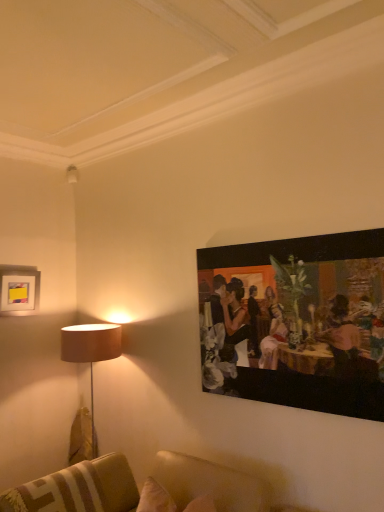
Question: Is the depth of leather couch at lower center less than that of matte white picture frame at upper left, which is the first picture frame in left-to-right order?

Choices:
 (A) yes
 (B) no

Answer: (A)

Question: Does leather couch at lower center lie behind matte white picture frame at upper left, marked as the 1th picture frame in a back-to-front arrangement?

Choices:
 (A) no
 (B) yes

Answer: (A)

Question: Is leather couch at lower center facing away from matte white picture frame at upper left, the 2th picture frame in the right-to-left sequence?

Choices:
 (A) no
 (B) yes

Answer: (A)

Question: Can you confirm if leather couch at lower center is smaller than matte white picture frame at upper left, the 2th picture frame in the right-to-left sequence?

Choices:
 (A) yes
 (B) no

Answer: (B)

Question: Is leather couch at lower center not within matte white picture frame at upper left, which is the first picture frame in left-to-right order?

Choices:
 (A) yes
 (B) no

Answer: (A)

Question: From the image's perspective, is leather couch at lower center located above matte white picture frame at upper left, the 2th picture frame in the right-to-left sequence?

Choices:
 (A) no
 (B) yes

Answer: (A)

Question: Does oil painting at upper right, the first picture frame when ordered from front to back, have a greater height compared to matte white picture frame at upper left, which is the first picture frame in left-to-right order?

Choices:
 (A) no
 (B) yes

Answer: (B)

Question: Is oil painting at upper right, which is the 2th picture frame in back-to-front order, further to camera compared to matte white picture frame at upper left, which is the first picture frame in left-to-right order?

Choices:
 (A) no
 (B) yes

Answer: (A)

Question: Is oil painting at upper right, which is the 2th picture frame in back-to-front order, wider than matte white picture frame at upper left, marked as the 1th picture frame in a back-to-front arrangement?

Choices:
 (A) yes
 (B) no

Answer: (B)

Question: From the image's perspective, is oil painting at upper right, the first picture frame when ordered from front to back, above matte white picture frame at upper left, which is the first picture frame in left-to-right order?

Choices:
 (A) no
 (B) yes

Answer: (A)

Question: Is oil painting at upper right, the first picture frame when ordered from front to back, smaller than matte white picture frame at upper left, which is the first picture frame in left-to-right order?

Choices:
 (A) yes
 (B) no

Answer: (B)

Question: From the image's perspective, is oil painting at upper right, which is the 2th picture frame in back-to-front order, located beneath matte white picture frame at upper left, the 2th picture frame in the right-to-left sequence?

Choices:
 (A) yes
 (B) no

Answer: (A)

Question: Is matte white picture frame at upper left, which ranks as the 2th picture frame in front-to-back order, facing towards oil painting at upper right, which is the 2th picture frame in back-to-front order?

Choices:
 (A) yes
 (B) no

Answer: (A)